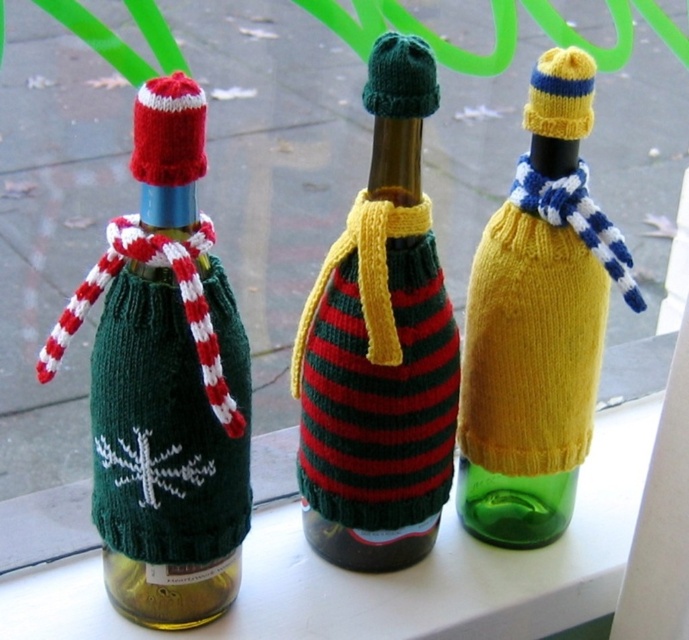
Based on the photo, does striped knit sweater at center come in front of yellow knitted sweater at center?

Yes, striped knit sweater at center is in front of yellow knitted sweater at center.

Is striped knit sweater at center to the left of yellow knitted sweater at center from the viewer's perspective?

Correct, you'll find striped knit sweater at center to the left of yellow knitted sweater at center.

Is point (390, 536) closer to viewer compared to point (508, 321)?

No, (390, 536) is behind (508, 321).

Where is `striped knit sweater at center`? striped knit sweater at center is located at coordinates (380, 346).

Looking at this image, who is taller, green knitted sweater at left or yellow knitted sweater at center?

yellow knitted sweater at center is taller.

Between green knitted sweater at left and yellow knitted sweater at center, which one is positioned higher?

Positioned higher is yellow knitted sweater at center.

Does point (156, 460) come in front of point (586, 250)?

That is True.

This screenshot has height=640, width=689. Find the location of `green knitted sweater at left`. green knitted sweater at left is located at coordinates [167, 448].

Can you confirm if striped knit sweater at center is smaller than green knitted sweater at left?

Actually, striped knit sweater at center might be larger than green knitted sweater at left.

Does striped knit sweater at center come behind green knitted sweater at left?

Yes, striped knit sweater at center is further from the viewer.

This screenshot has height=640, width=689. I want to click on striped knit sweater at center, so click(x=380, y=346).

This screenshot has width=689, height=640. I want to click on striped knit sweater at center, so click(x=380, y=346).